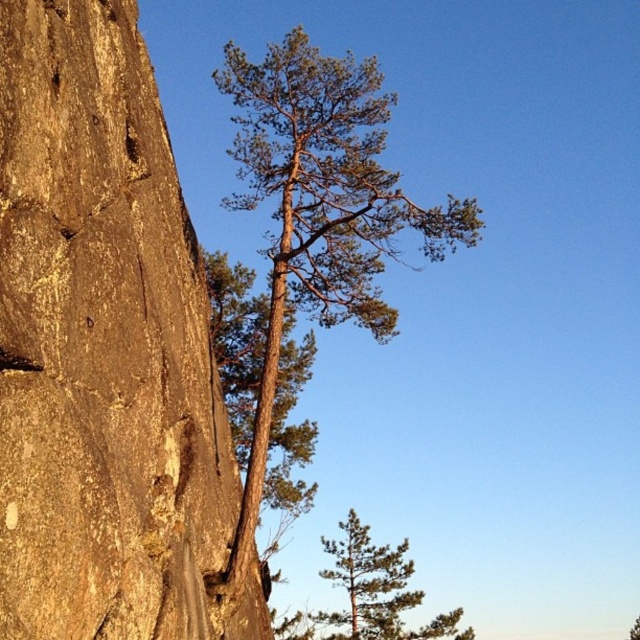
Question: Which point appears farthest from the camera in this image?

Choices:
 (A) (67, 365)
 (B) (394, 632)
 (C) (298, 122)

Answer: (B)

Question: Can you confirm if brown rough rock at left is thinner than green needle-like tree at lower center?

Choices:
 (A) no
 (B) yes

Answer: (B)

Question: Is green needle-like foliage at center behind green needle-like tree at lower center?

Choices:
 (A) no
 (B) yes

Answer: (A)

Question: Which object appears farthest from the camera in this image?

Choices:
 (A) green needle-like tree at lower center
 (B) brown rough rock at left

Answer: (A)

Question: Does brown rough rock at left have a lesser width compared to green needle-like tree at lower center?

Choices:
 (A) yes
 (B) no

Answer: (A)

Question: Based on their relative distances, which object is farther from the green needle-like tree at lower center?

Choices:
 (A) green needle-like foliage at center
 (B) brown rough rock at left

Answer: (B)